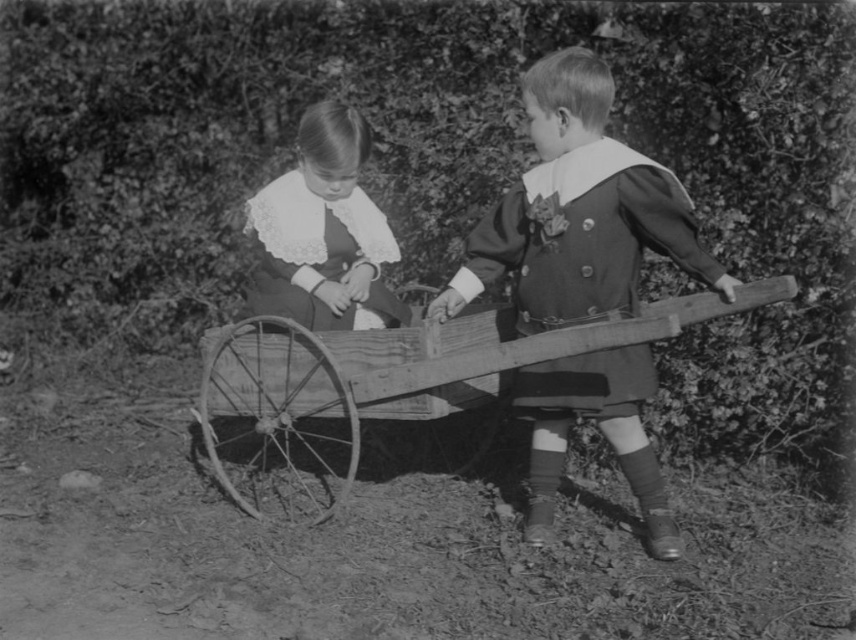
Is wooden wagon at center positioned behind white lace dress at center?

No, wooden wagon at center is closer to the viewer.

Is wooden wagon at center smaller than white lace dress at center?

No, wooden wagon at center is not smaller than white lace dress at center.

At what (x,y) coordinates should I click in order to perform the action: click on wooden wagon at center. Please return your answer as a coordinate pair (x, y). Image resolution: width=856 pixels, height=640 pixels. Looking at the image, I should click on (379, 388).

Can you confirm if wooden wagon at center is taller than matte black dress at center?

No, wooden wagon at center is not taller than matte black dress at center.

Between point (724, 314) and point (615, 236), which one is positioned in front?

Positioned in front is point (615, 236).

Locate an element on the screen. wooden wagon at center is located at coordinates (379, 388).

Is smooth wood plank at right closer to camera compared to wooden wagon at center?

No, smooth wood plank at right is further to the viewer.

This screenshot has height=640, width=856. Identify the location of smooth wood plank at right. (578, 211).

The width and height of the screenshot is (856, 640). I want to click on smooth wood plank at right, so click(x=578, y=211).